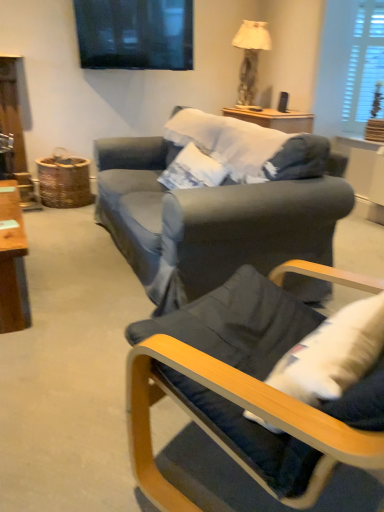
In order to face dark blue fabric chair at lower right, should I rotate leftwards or rightwards?

A 18.133 degree turn to the right will do.

The height and width of the screenshot is (512, 384). I want to click on matte beige lampshade at upper right, so click(250, 57).

Identify the location of white wooden blinds at upper right. The width and height of the screenshot is (384, 512). (365, 68).

What are the coordinates of `dark blue fabric chair at lower right` in the screenshot? It's located at (245, 394).

I want to click on lamp on the right of dark blue fabric chair at lower right, so click(250, 57).

From the picture: Measure the distance between dark blue fabric chair at lower right and matte beige lampshade at upper right.

The distance of dark blue fabric chair at lower right from matte beige lampshade at upper right is 3.16 meters.

Considering the relative sizes of dark blue fabric chair at lower right and matte beige lampshade at upper right in the image provided, is dark blue fabric chair at lower right bigger than matte beige lampshade at upper right?

Incorrect, dark blue fabric chair at lower right is not larger than matte beige lampshade at upper right.

Is dark blue fabric chair at lower right situated inside matte beige lampshade at upper right or outside?

dark blue fabric chair at lower right exists outside the volume of matte beige lampshade at upper right.

Where is `window below the matte beige lampshade at upper right (from a real-world perspective)`? The height and width of the screenshot is (512, 384). window below the matte beige lampshade at upper right (from a real-world perspective) is located at coordinates tap(365, 68).

Which point is more distant from viewer, (242, 104) or (380, 0)?

Positioned behind is point (242, 104).

In the scene shown: Is matte beige lampshade at upper right not within white wooden blinds at upper right?

Yes, matte beige lampshade at upper right is outside of white wooden blinds at upper right.

From a real-world perspective, which is physically above, matte beige lampshade at upper right or white wooden blinds at upper right?

matte beige lampshade at upper right.

At what (x,y) coordinates should I click in order to perform the action: click on chair on the left of the white wooden blinds at upper right. Please return your answer as a coordinate pair (x, y). Looking at the image, I should click on (245, 394).

Can you see white wooden blinds at upper right touching dark blue fabric chair at lower right?

No, white wooden blinds at upper right is not with dark blue fabric chair at lower right.

Does white wooden blinds at upper right appear on the right side of dark blue fabric chair at lower right?

Yes, white wooden blinds at upper right is to the right of dark blue fabric chair at lower right.

Which object is closer to the camera, matte beige lampshade at upper right or dark blue fabric chair at lower right?

dark blue fabric chair at lower right is in front.

Based on the photo, does matte beige lampshade at upper right have a greater width compared to dark blue fabric chair at lower right?

Indeed, matte beige lampshade at upper right has a greater width compared to dark blue fabric chair at lower right.

Between matte beige lampshade at upper right and dark blue fabric chair at lower right, which one appears on the left side from the viewer's perspective?

dark blue fabric chair at lower right.

In the scene shown: Is dark blue fabric chair at lower right touching white wooden blinds at upper right?

No, dark blue fabric chair at lower right is not making contact with white wooden blinds at upper right.

Who is shorter, dark blue fabric chair at lower right or white wooden blinds at upper right?

dark blue fabric chair at lower right is shorter.

Locate an element on the screen. The width and height of the screenshot is (384, 512). window that is on the right side of dark blue fabric chair at lower right is located at coordinates (365, 68).

Is dark blue fabric chair at lower right outside of white wooden blinds at upper right?

Yes, dark blue fabric chair at lower right is located beyond the bounds of white wooden blinds at upper right.

Is white wooden blinds at upper right facing towards matte beige lampshade at upper right?

No, white wooden blinds at upper right is not oriented towards matte beige lampshade at upper right.

Would you consider white wooden blinds at upper right to be distant from matte beige lampshade at upper right?

They are positioned close to each other.

In the scene shown: Which is nearer, (x=356, y=127) or (x=247, y=33)?

Point (x=356, y=127) is farther from the camera than point (x=247, y=33).

This screenshot has width=384, height=512. In order to click on lamp above the dark blue fabric chair at lower right (from the image's perspective) in this screenshot , I will do `click(250, 57)`.

The height and width of the screenshot is (512, 384). Find the location of `lamp that appears above the white wooden blinds at upper right (from a real-world perspective)`. lamp that appears above the white wooden blinds at upper right (from a real-world perspective) is located at coordinates (250, 57).

Looking at this image, looking at the image, which one is located further to white wooden blinds at upper right, dark blue fabric chair at lower right or matte beige lampshade at upper right?

Among the two, dark blue fabric chair at lower right is located further to white wooden blinds at upper right.

Which object lies further to the anchor point dark blue fabric chair at lower right, white wooden blinds at upper right or matte beige lampshade at upper right?

Among the two, white wooden blinds at upper right is located further to dark blue fabric chair at lower right.

Looking at the image, which one is located further to matte beige lampshade at upper right, dark blue fabric chair at lower right or white wooden blinds at upper right?

dark blue fabric chair at lower right is further to matte beige lampshade at upper right.

Based on the photo, considering their positions, is matte beige lampshade at upper right positioned closer to white wooden blinds at upper right than dark blue fabric chair at lower right?

matte beige lampshade at upper right lies closer to white wooden blinds at upper right than the other object.

From the image, which object appears to be nearer to matte beige lampshade at upper right, white wooden blinds at upper right or dark blue fabric chair at lower right?

white wooden blinds at upper right is positioned closer to the anchor matte beige lampshade at upper right.

Which object lies nearer to the anchor point dark blue fabric chair at lower right, matte beige lampshade at upper right or white wooden blinds at upper right?

Based on the image, matte beige lampshade at upper right appears to be nearer to dark blue fabric chair at lower right.

At what (x,y) coordinates should I click in order to perform the action: click on lamp positioned between dark blue fabric chair at lower right and white wooden blinds at upper right from near to far. Please return your answer as a coordinate pair (x, y). This screenshot has height=512, width=384. Looking at the image, I should click on (250, 57).